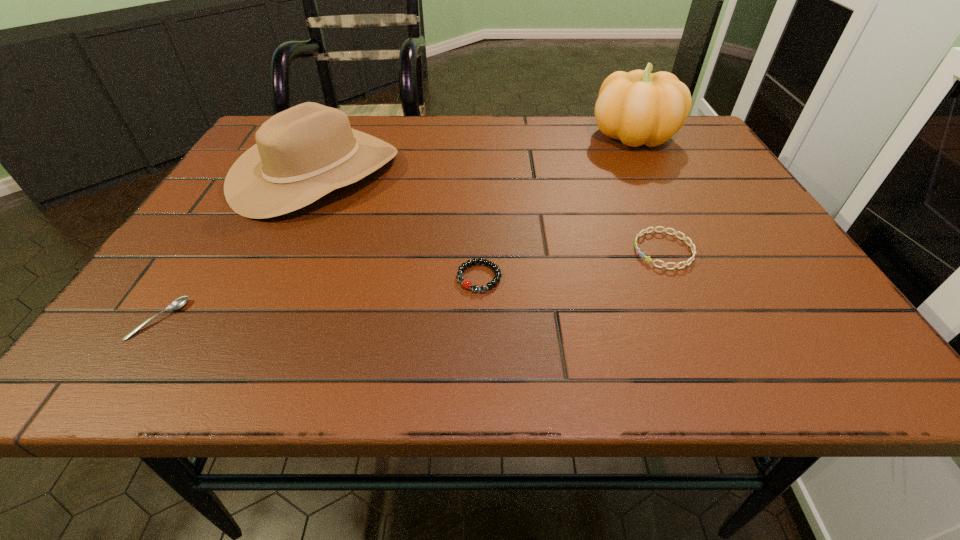
Identify the location of free space located 0.380m on the surface of the right bracelet showing star-shaped elements. (438, 250).

The image size is (960, 540). I want to click on free space located 0.360m on the surface of the right bracelet showing star-shaped elements, so click(448, 250).

Locate an element on the screen. The image size is (960, 540). vacant space located on the front of the left bracelet is located at coordinates (479, 368).

This screenshot has width=960, height=540. Find the location of `vacant area located on the back of the shortest object`. vacant area located on the back of the shortest object is located at coordinates (228, 215).

At what (x,y) coordinates should I click in order to perform the action: click on pumpkin at the far edge. Please return your answer as a coordinate pair (x, y). This screenshot has height=540, width=960. Looking at the image, I should click on (639, 107).

You are a GUI agent. You are given a task and a screenshot of the screen. Output one action in this format:
    pyautogui.click(x=<x>, y=<y>)
    Task: Click on the cowboy hat positioned at the far edge
    This screenshot has width=960, height=540.
    Given the screenshot: What is the action you would take?
    pyautogui.click(x=303, y=153)

In order to click on object that is at the near edge in this screenshot , I will do `click(180, 302)`.

This screenshot has width=960, height=540. I want to click on cowboy hat present at the left edge, so click(x=303, y=153).

Where is `soupspoon at the left edge`? soupspoon at the left edge is located at coordinates (180, 302).

The width and height of the screenshot is (960, 540). Identify the location of object present at the right edge. (639, 107).